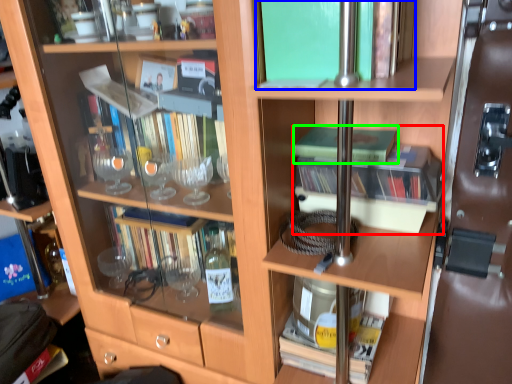
Question: Based on their relative distances, which object is farther from book (highlighted by a red box)? Choose from book (highlighted by a blue box) and book (highlighted by a green box).

Choices:
 (A) book
 (B) book

Answer: (A)